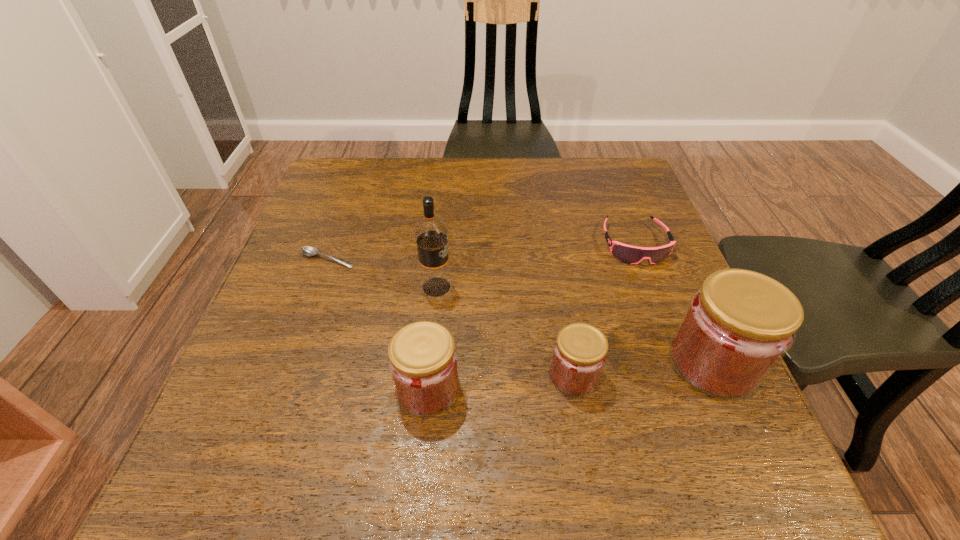
Identify the location of free space that is in between the goggles and the fourth tallest object. (605, 309).

I want to click on vacant area between the shortest jam and the tallest jam, so click(643, 369).

Image resolution: width=960 pixels, height=540 pixels. I want to click on free space between the fifth shortest object and the shortest object, so click(520, 310).

Find the location of a particular element. The height and width of the screenshot is (540, 960). vacant area that lies between the vodka and the leftmost object is located at coordinates (382, 273).

You are a GUI agent. You are given a task and a screenshot of the screen. Output one action in this format:
    pyautogui.click(x=<x>, y=<y>)
    Task: Click on the unoccupied position between the shortest object and the second shortest object
    This screenshot has height=540, width=960.
    Given the screenshot: What is the action you would take?
    pyautogui.click(x=481, y=252)

I want to click on unoccupied area between the goggles and the third tallest object, so (532, 316).

Identify which object is located as the second nearest to the leftmost jam. Please provide its 2D coordinates. Your answer should be formatted as a tuple, i.e. [(x, y)], where the tuple contains the x and y coordinates of a point satisfying the conditions above.

[(580, 351)]

Where is `object that is the fifth closest to the fourth nearest object`? object that is the fifth closest to the fourth nearest object is located at coordinates (739, 324).

Locate an element on the screen. Image resolution: width=960 pixels, height=540 pixels. jam that can be found as the second closest to the fifth tallest object is located at coordinates (580, 351).

Locate which jam is the closest to the fifth shortest object. Please provide its 2D coordinates. Your answer should be formatted as a tuple, i.e. [(x, y)], where the tuple contains the x and y coordinates of a point satisfying the conditions above.

[(580, 351)]